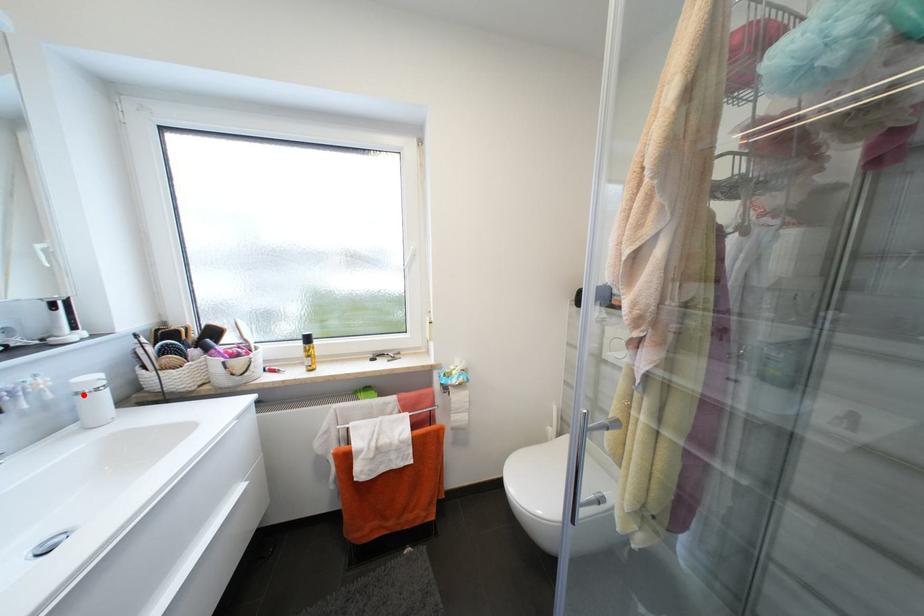
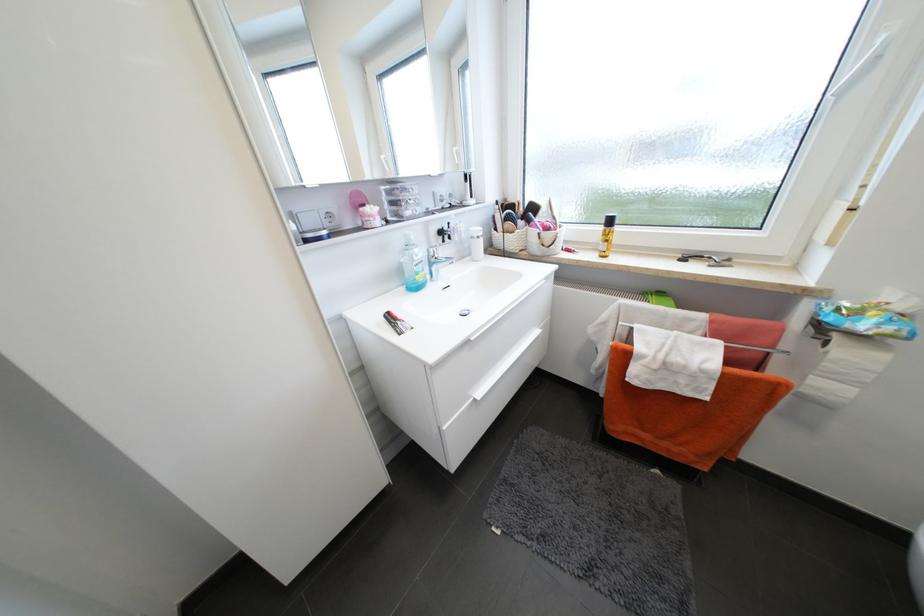
Locate, in the second image, the point that corresponds to the highlighted location in the first image.

(478, 238)